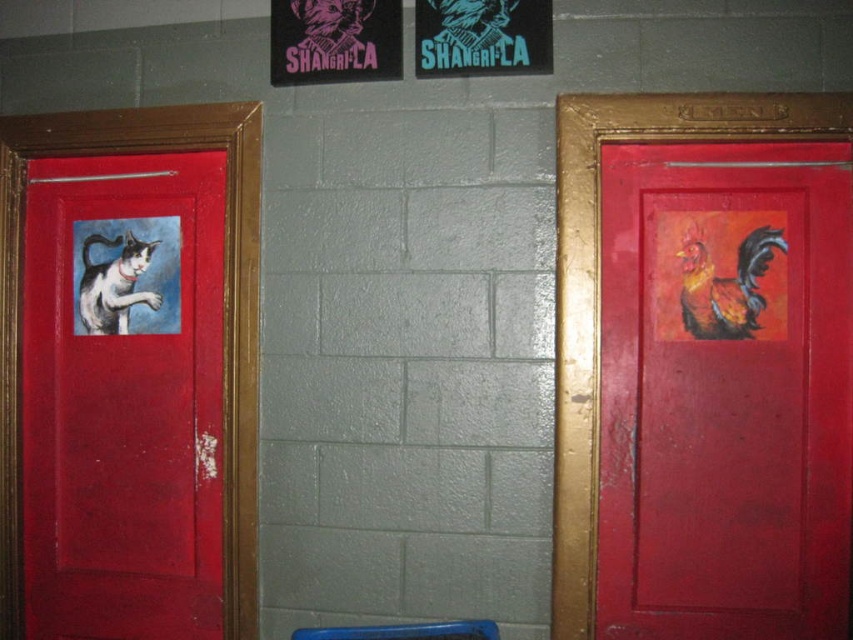
Identify the location of matte pink poster at upper center. Image resolution: width=853 pixels, height=640 pixels. (334, 40).

From the picture: Does matte pink poster at upper center have a lesser width compared to flaming orange rooster at right?

No, matte pink poster at upper center is not thinner than flaming orange rooster at right.

This screenshot has width=853, height=640. I want to click on matte pink poster at upper center, so click(334, 40).

Where is `matte pink poster at upper center`? This screenshot has height=640, width=853. matte pink poster at upper center is located at coordinates (x=334, y=40).

Which is behind, point (641, 618) or point (309, 628)?

The point (309, 628) is more distant.

Locate an element on the screen. This screenshot has height=640, width=853. matte red door at right is located at coordinates (724, 392).

Is matte pink poster at upper center behind blue plastic stool at lower center?

Yes, matte pink poster at upper center is behind blue plastic stool at lower center.

Describe the element at coordinates (334, 40) in the screenshot. This screenshot has height=640, width=853. I see `matte pink poster at upper center` at that location.

This screenshot has width=853, height=640. Identify the location of matte pink poster at upper center. (334, 40).